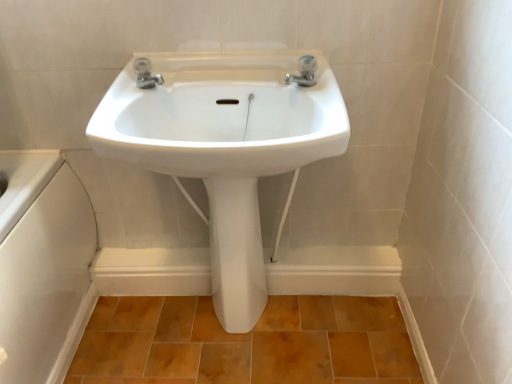
Question: From the image's perspective, is silver metallic tap at upper center, which is the second tap from left to right, above or below satin nickel faucet at upper center, the second tap from the right?

Choices:
 (A) above
 (B) below

Answer: (A)

Question: In terms of width, does silver metallic tap at upper center, which is the second tap from left to right, look wider or thinner when compared to satin nickel faucet at upper center, acting as the first tap starting from the left?

Choices:
 (A) thin
 (B) wide

Answer: (B)

Question: Estimate the real-world distances between objects in this image. Which object is closer to the silver metallic tap at upper center, the 1th tap from the right?

Choices:
 (A) brown matte tile at lower center
 (B) satin nickel faucet at upper center, acting as the first tap starting from the left
 (C) white glossy sink at center
 (D) white glossy pedestal at center

Answer: (C)

Question: Based on their relative distances, which object is nearer to the silver metallic tap at upper center, the 1th tap from the right?

Choices:
 (A) white glossy sink at center
 (B) white glossy pedestal at center
 (C) satin nickel faucet at upper center, the second tap from the right
 (D) brown matte tile at lower center

Answer: (A)